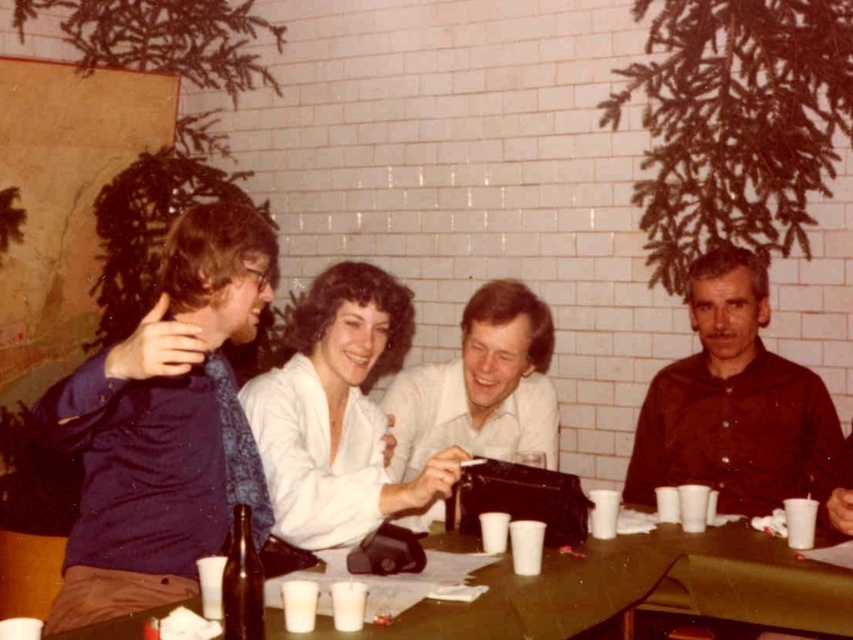
Between dark brown shirt at right and white glossy shirt at center, which one appears on the left side from the viewer's perspective?

white glossy shirt at center is more to the left.

Between point (699, 378) and point (416, 528), which one is positioned in front?

Positioned in front is point (416, 528).

Describe the element at coordinates (735, 404) in the screenshot. I see `dark brown shirt at right` at that location.

The image size is (853, 640). I want to click on dark brown shirt at right, so click(735, 404).

Identify the location of dark brown shirt at right. (735, 404).

Does dark brown shirt at right have a greater height compared to white satin blouse at center?

Indeed, dark brown shirt at right has a greater height compared to white satin blouse at center.

Image resolution: width=853 pixels, height=640 pixels. I want to click on dark brown shirt at right, so click(735, 404).

Does dark brown shirt at right come behind brown glass bottle at lower left?

Yes, dark brown shirt at right is further from the viewer.

Can you confirm if dark brown shirt at right is positioned to the right of brown glass bottle at lower left?

Indeed, dark brown shirt at right is positioned on the right side of brown glass bottle at lower left.

I want to click on dark brown shirt at right, so click(735, 404).

Where is `dark brown shirt at right`? The width and height of the screenshot is (853, 640). dark brown shirt at right is located at coordinates (735, 404).